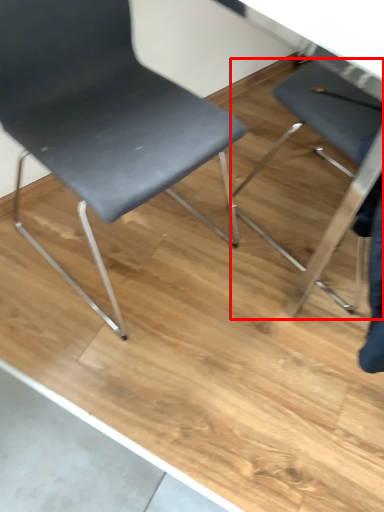
Question: From the image's perspective, considering the relative positions of chair (annotated by the red box) and chair in the image provided, where is chair (annotated by the red box) located with respect to the staircase?

Choices:
 (A) below
 (B) above

Answer: (A)